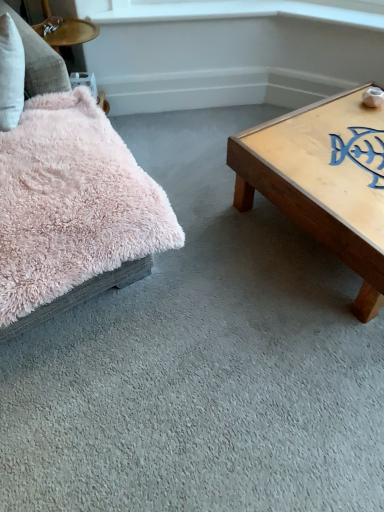
Question: From the image's perspective, relative to fluffy pink pillow at left, is light brown wooden coffee table at right above or below?

Choices:
 (A) below
 (B) above

Answer: (B)

Question: Is light brown wooden coffee table at right taller or shorter than fluffy pink pillow at left?

Choices:
 (A) tall
 (B) short

Answer: (B)

Question: Estimate the real-world distances between objects in this image. Which object is closer to the white glossy window sill at upper center?

Choices:
 (A) fluffy pink pillow at left
 (B) fuzzy pink pillow at upper left
 (C) light brown wooden coffee table at right

Answer: (B)

Question: Estimate the real-world distances between objects in this image. Which object is closer to the fuzzy pink pillow at upper left?

Choices:
 (A) light brown wooden coffee table at right
 (B) white glossy window sill at upper center
 (C) fluffy pink pillow at left

Answer: (C)